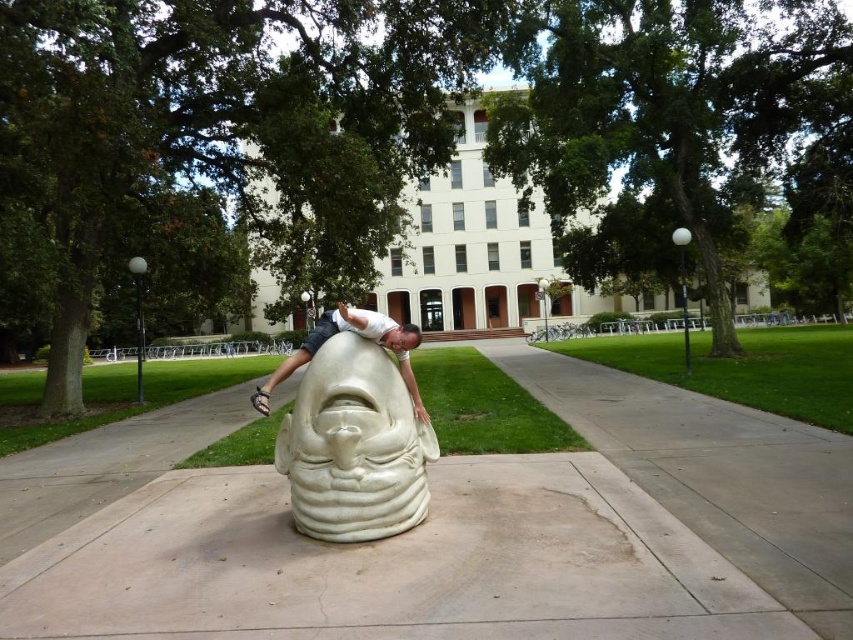
Does point (642, 554) come closer to viewer compared to point (410, 458)?

Yes.

Is point (503, 595) closer to camera compared to point (390, 481)?

That is True.

You are a GUI agent. You are given a task and a screenshot of the screen. Output one action in this format:
    pyautogui.click(x=<x>, y=<y>)
    Task: Click on the white concrete sculpture at center
    The image size is (853, 640).
    Given the screenshot: What is the action you would take?
    pyautogui.click(x=389, y=564)

Does white concrete sculpture at center appear over white matte sculpture at center?

Incorrect, white concrete sculpture at center is not positioned above white matte sculpture at center.

Can you confirm if white concrete sculpture at center is positioned to the right of white matte sculpture at center?

Indeed, white concrete sculpture at center is positioned on the right side of white matte sculpture at center.

Who is more distant from viewer, (265, 483) or (276, 371)?

Point (276, 371)

In order to click on white concrete sculpture at center in this screenshot , I will do `click(389, 564)`.

Does white marble sculpture at center appear under white matte sculpture at center?

Indeed, white marble sculpture at center is positioned under white matte sculpture at center.

Locate an element on the screen. white marble sculpture at center is located at coordinates (354, 445).

Find the location of a particular element. The image size is (853, 640). white marble sculpture at center is located at coordinates (354, 445).